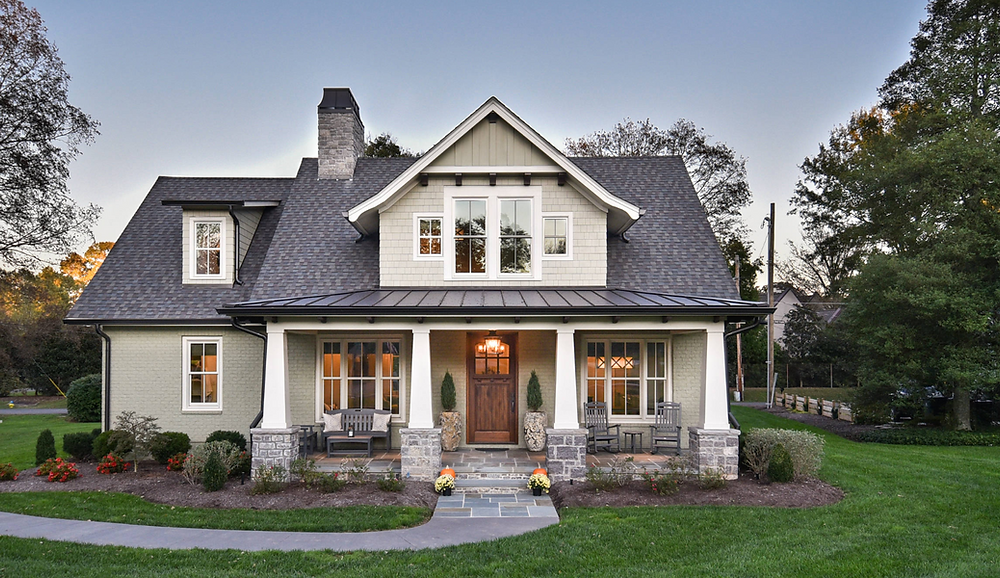
Image resolution: width=1000 pixels, height=578 pixels. Find the location of `windows in house`. windows in house is located at coordinates (203, 242), (419, 228), (477, 228), (531, 223), (565, 225), (196, 380), (339, 366), (507, 339), (635, 359).